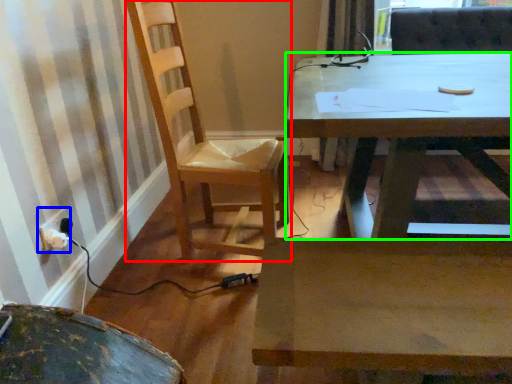
Question: Which is nearer to the chair (highlighted by a red box)? electric outlet (highlighted by a blue box) or desk (highlighted by a green box).

Choices:
 (A) electric outlet
 (B) desk

Answer: (B)